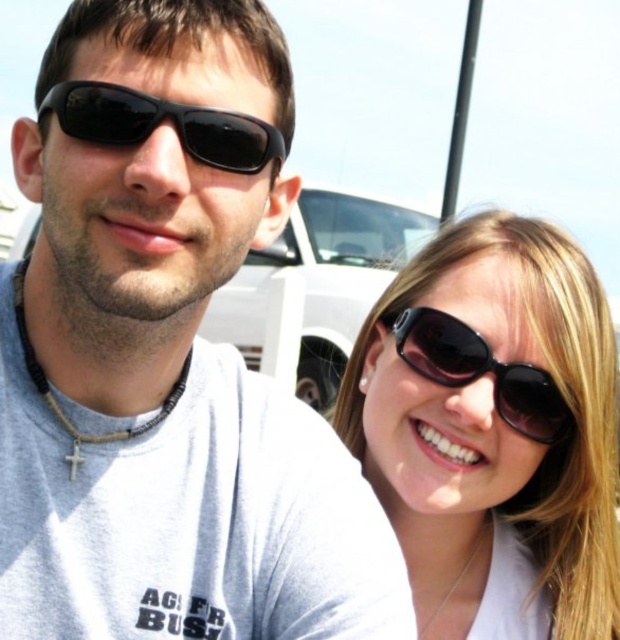
You are an app developer working on a facial recognition system. You need to determine if the black matte sunglasses at upper center are positioned above the eyes of the person wearing them. Based on the coordinates provided, can you confirm this?

The black matte sunglasses at upper center are positioned at point (161, 122), which is above the eyes of the person wearing them, so yes, they are correctly positioned.

You are a photographer trying to capture the perfect shot of the matte black sunglasses at upper left. You need to position your camera so that the sunglasses are centered at the point specified in the scene. What are the coordinates where you should aim your camera?

The coordinates where you should aim your camera are at point (166,355) to center the matte black sunglasses at upper left.